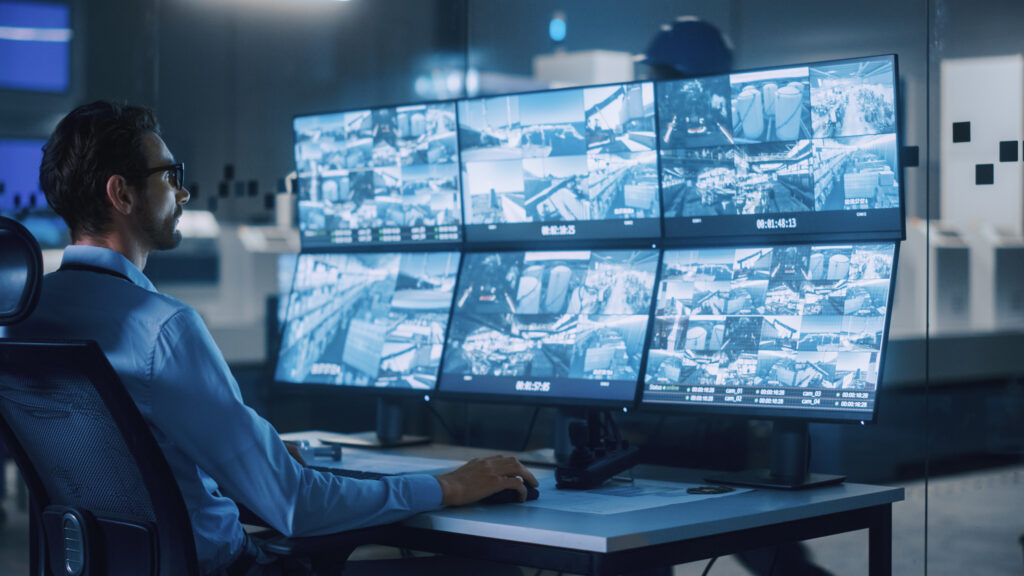
Locate an element on the screen. screens is located at coordinates [x=771, y=122], [x=759, y=312], [x=575, y=316], [x=563, y=187], [x=396, y=176], [x=389, y=327].